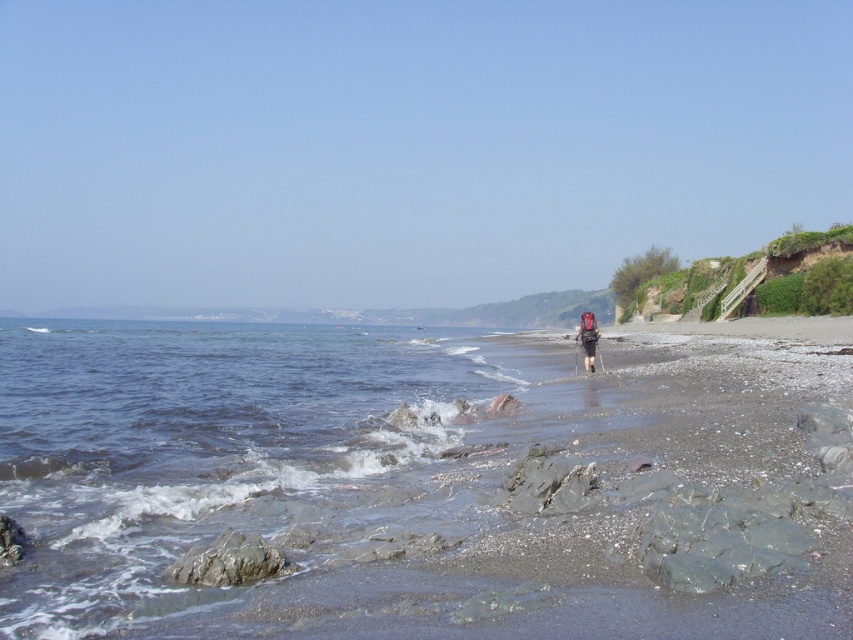
In the scene shown: Does clear water at lower left appear under matte black backpack at center?

Correct, clear water at lower left is located below matte black backpack at center.

Which is more to the right, clear water at lower left or matte black backpack at center?

matte black backpack at center

Where is `clear water at lower left`? clear water at lower left is located at coordinates tap(218, 452).